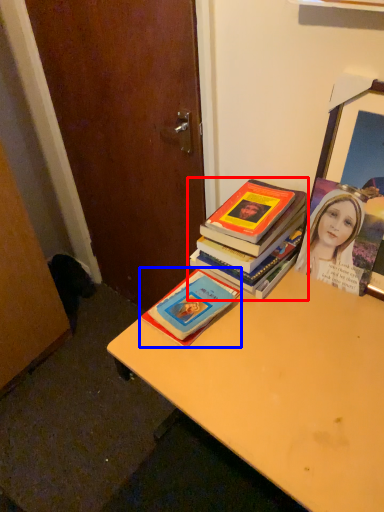
Question: Which object is further to the camera taking this photo, book (highlighted by a red box) or book (highlighted by a blue box)?

Choices:
 (A) book
 (B) book

Answer: (A)